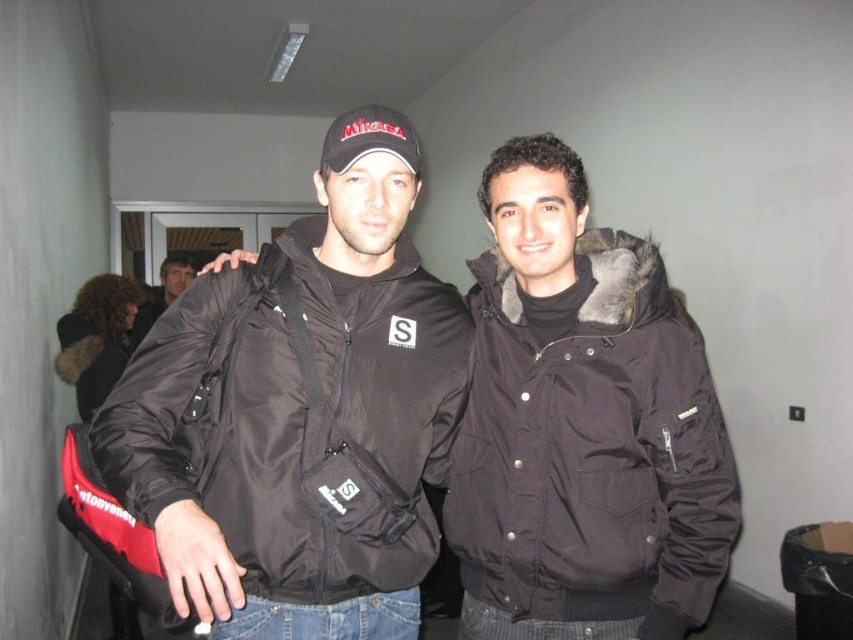
Question: Does black matte jacket at center have a larger size compared to black synthetic jacket at center?

Choices:
 (A) no
 (B) yes

Answer: (B)

Question: Does black synthetic jacket at center have a greater width compared to matte black jacket at center?

Choices:
 (A) no
 (B) yes

Answer: (B)

Question: Is the position of black synthetic jacket at center less distant than that of black synthetic fur-lined jacket at center?

Choices:
 (A) no
 (B) yes

Answer: (B)

Question: Which point appears closest to the camera in this image?

Choices:
 (A) (277, 369)
 (B) (339, 548)

Answer: (B)

Question: Among these points, which one is farthest from the camera?

Choices:
 (A) (601, 362)
 (B) (360, 365)
 (C) (186, 285)

Answer: (C)

Question: Which point is closer to the camera?

Choices:
 (A) matte black jacket at center
 (B) black synthetic fur-lined jacket at center
 (C) black matte jacket at center

Answer: (C)